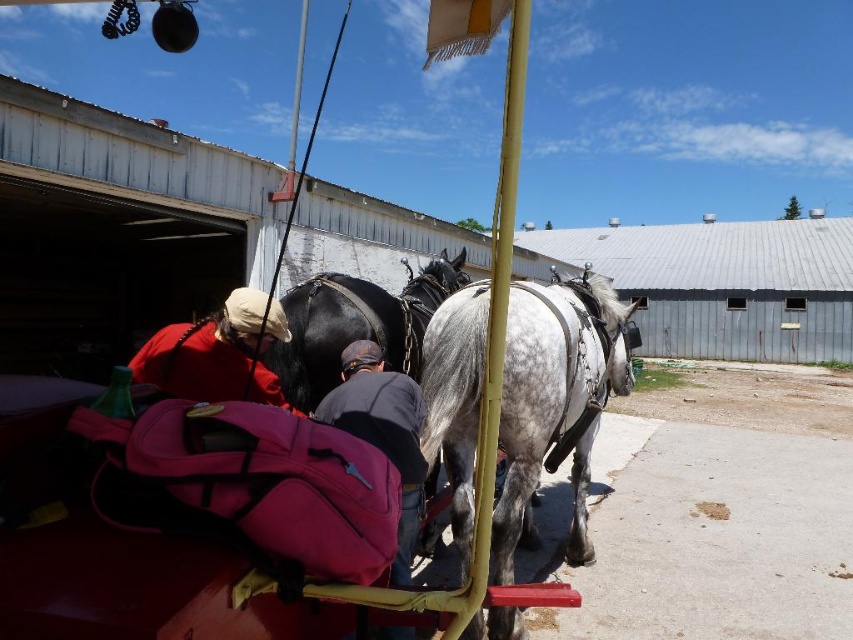
You are a photographer planning to take a photo of the speckled white horse at center and the matte red jacket at upper left. If you want to ensure both subjects are in focus, which one should you position closer to the camera to maintain clarity?

The speckled white horse at center is larger in width than the matte red jacket at upper left, so positioning the horse closer to the camera will help maintain clarity for both subjects.

You are a tourist standing at the edge of the scene and want to take a photo of the speckled white horse at center and the matte red jacket at upper left. To ensure both are in the frame, should you position yourself to the left or right of the cart?

You should position yourself to the left of the cart because the speckled white horse at center is to the right of the matte red jacket at upper left, so placing yourself to the left will keep both in the frame.